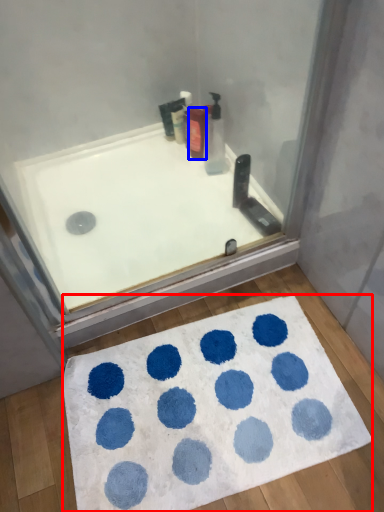
Question: Among these objects, which one is nearest to the camera, bath mat (highlighted by a red box) or toiletry (highlighted by a blue box)?

Choices:
 (A) bath mat
 (B) toiletry

Answer: (A)